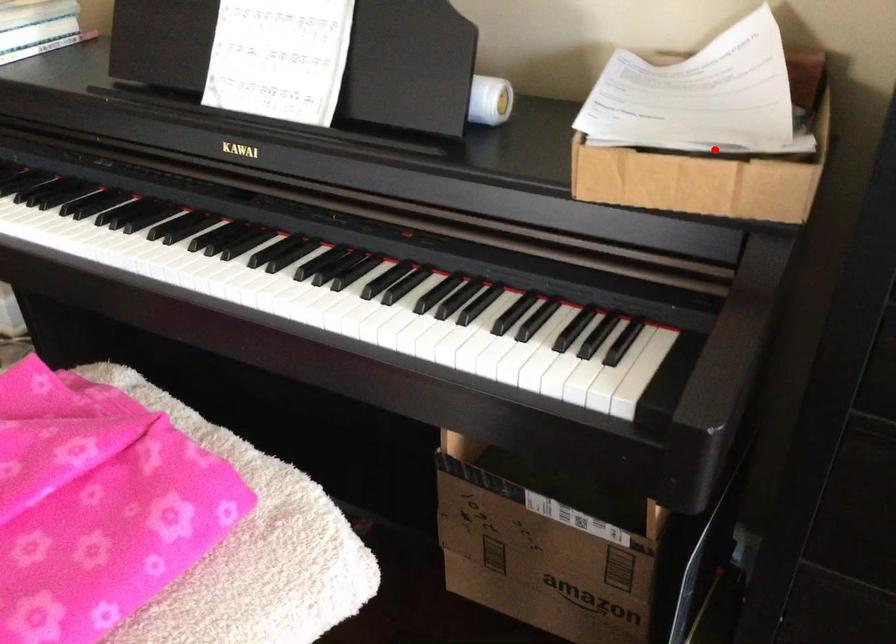
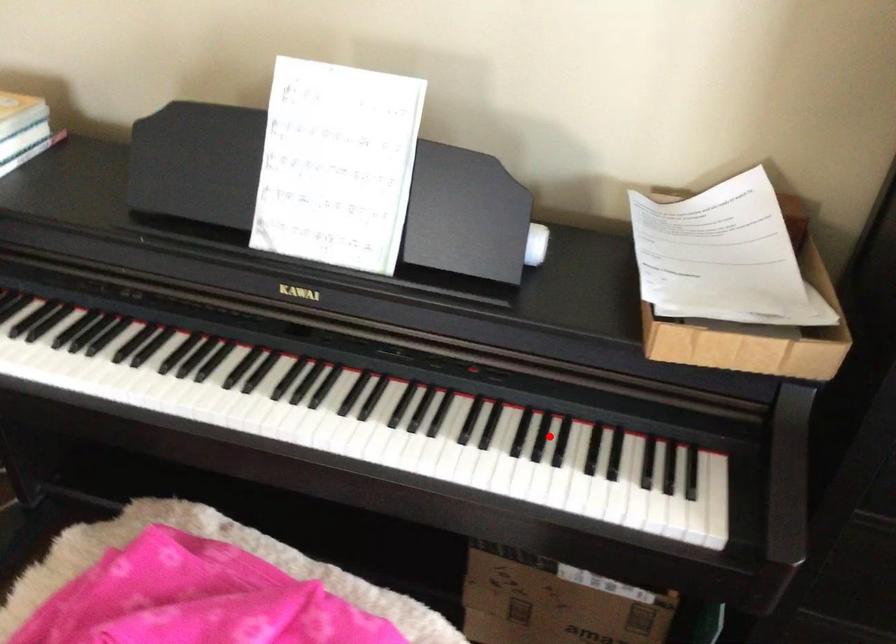
I am providing you with two images of the same scene from different viewpoints. A red point is marked on the first image and another point is marked on the second image. Is the marked point in image1 the same physical position as the marked point in image2?

No